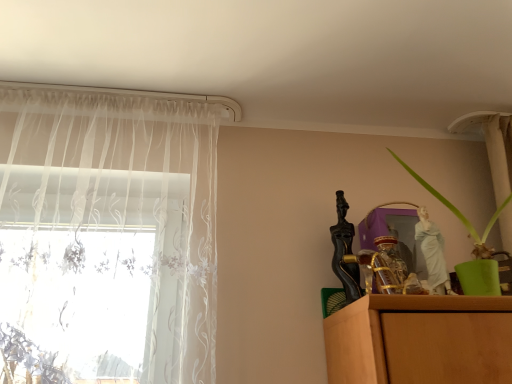
Question: Considering the relative sizes of green matte plant at right and white sheer curtain at left in the image provided, is green matte plant at right smaller than white sheer curtain at left?

Choices:
 (A) yes
 (B) no

Answer: (A)

Question: Is the depth of green matte plant at right greater than that of white sheer curtain at left?

Choices:
 (A) no
 (B) yes

Answer: (A)

Question: Does green matte plant at right have a greater width compared to white sheer curtain at left?

Choices:
 (A) no
 (B) yes

Answer: (B)

Question: From a real-world perspective, is green matte plant at right positioned under white sheer curtain at left based on gravity?

Choices:
 (A) no
 (B) yes

Answer: (B)

Question: Is green matte plant at right at the right side of white sheer curtain at left?

Choices:
 (A) no
 (B) yes

Answer: (B)

Question: From a real-world perspective, is green matte plant at right physically above white sheer curtain at left?

Choices:
 (A) no
 (B) yes

Answer: (A)

Question: Is white sheer curtain at left oriented towards green matte plant at right?

Choices:
 (A) yes
 (B) no

Answer: (B)

Question: Is white sheer curtain at left looking in the opposite direction of green matte plant at right?

Choices:
 (A) yes
 (B) no

Answer: (B)

Question: Does white sheer curtain at left come in front of green matte plant at right?

Choices:
 (A) no
 (B) yes

Answer: (A)

Question: Is white sheer curtain at left positioned far away from green matte plant at right?

Choices:
 (A) yes
 (B) no

Answer: (B)

Question: Are white sheer curtain at left and green matte plant at right beside each other?

Choices:
 (A) yes
 (B) no

Answer: (B)

Question: Does white sheer curtain at left have a greater height compared to green matte plant at right?

Choices:
 (A) no
 (B) yes

Answer: (B)

Question: Choose the correct answer: Is green matte plant at right inside white sheer curtain at left or outside it?

Choices:
 (A) outside
 (B) inside

Answer: (A)